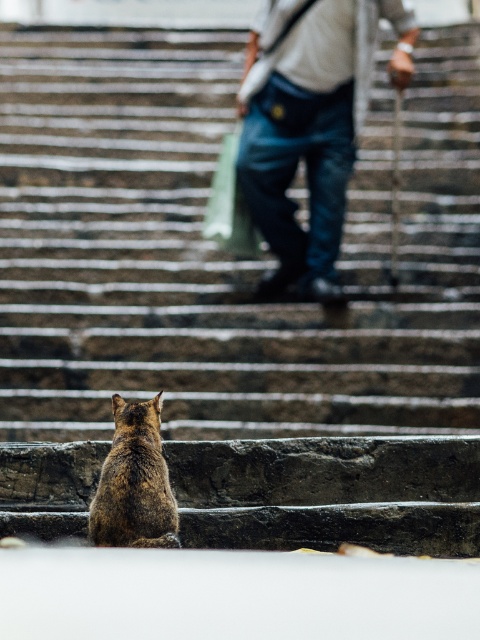
Question: Does denim jeans at upper center appear over brown fur cat at lower left?

Choices:
 (A) no
 (B) yes

Answer: (B)

Question: Which object is closer to the camera taking this photo?

Choices:
 (A) denim jeans at upper center
 (B) brown fur cat at lower left

Answer: (B)

Question: Among these points, which one is nearest to the camera?

Choices:
 (A) (311, 145)
 (B) (153, 477)

Answer: (B)

Question: Is denim jeans at upper center wider than brown fur cat at lower left?

Choices:
 (A) yes
 (B) no

Answer: (A)

Question: Does denim jeans at upper center appear under brown fur cat at lower left?

Choices:
 (A) yes
 (B) no

Answer: (B)